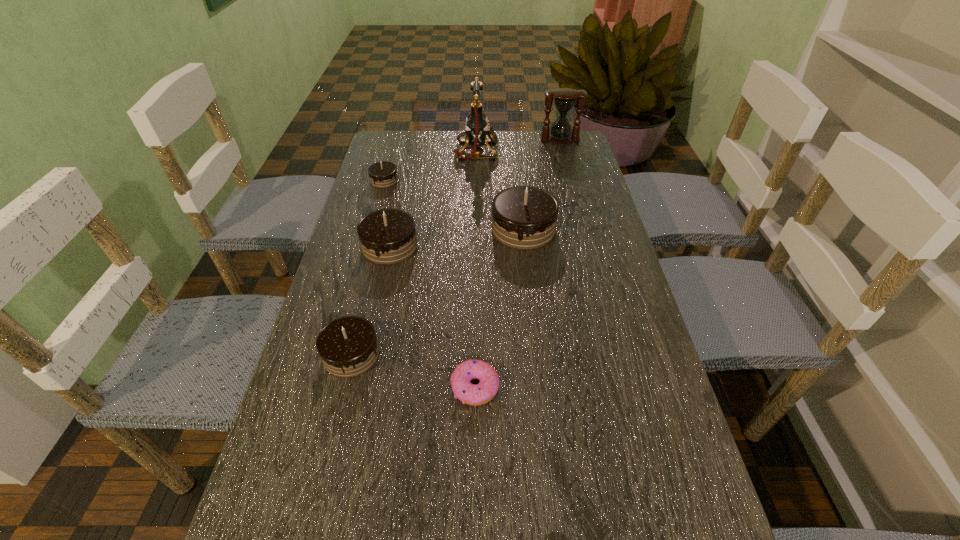
Identify the location of the farthest chocolate chocolate cake. The height and width of the screenshot is (540, 960). (383, 174).

Locate an element on the screen. The image size is (960, 540). the smallest chocolate chocolate cake is located at coordinates (383, 174).

This screenshot has width=960, height=540. I want to click on the third shortest object, so click(479, 394).

Where is `pink doughnut`? pink doughnut is located at coordinates (479, 394).

I want to click on vacant space located on the front of the black telephone, featuring the rotary dial, so [x=563, y=152].

The width and height of the screenshot is (960, 540). I want to click on vacant space located on the front of the rightmost object, so click(x=567, y=168).

I want to click on free space located on the left of the tallest chocolate cake, so click(468, 230).

Where is `free spot located on the front of the fourth tallest object`? This screenshot has height=540, width=960. free spot located on the front of the fourth tallest object is located at coordinates (363, 369).

The image size is (960, 540). I want to click on vacant space located 0.090m on the back of the nearest chocolate chocolate cake, so click(364, 302).

I want to click on free space located 0.280m on the right of the farthest chocolate cake, so click(x=484, y=180).